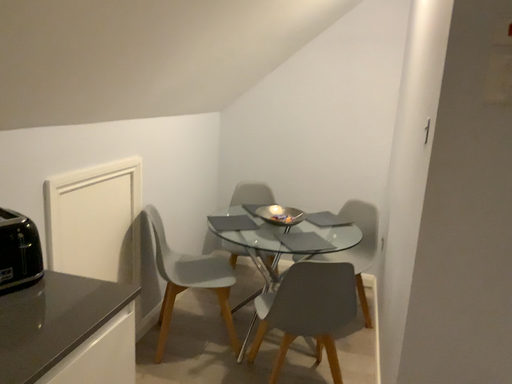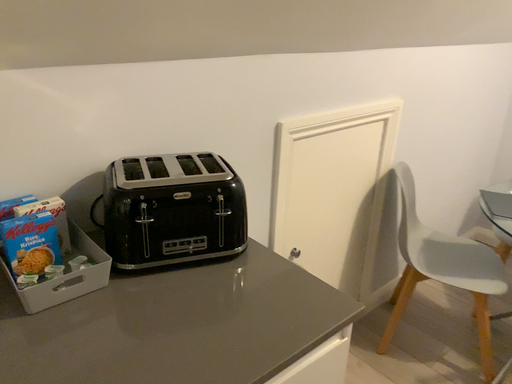
Question: How did the camera likely rotate when shooting the video?

Choices:
 (A) rotated left
 (B) rotated right

Answer: (A)